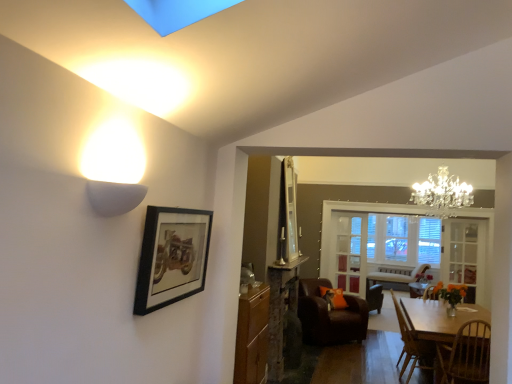
Question: Considering their positions, is clear glass door at center, the second glass door positioned from the right, located in front of or behind wooden chair at lower right, which ranks as the 2th chair in front-to-back order?

Choices:
 (A) behind
 (B) front

Answer: (A)

Question: Considering the positions of clear glass door at center, marked as the second glass door in a front-to-back arrangement, and wooden chair at lower right, the second chair in the back-to-front sequence, in the image, is clear glass door at center, marked as the second glass door in a front-to-back arrangement, wider or thinner than wooden chair at lower right, the second chair in the back-to-front sequence,?

Choices:
 (A) wide
 (B) thin

Answer: (B)

Question: Estimate the real-world distances between objects in this image. Which object is farther from the clear glass door at center, the second glass door positioned from the right?

Choices:
 (A) wooden cabinet at center
 (B) brown leather armchair at center, which is the third chair in front-to-back order
 (C) wooden dining table at lower right
 (D) wooden chair at lower right, the second chair in the back-to-front sequence
 (E) clear glass door at center, which ranks as the 2th glass door in back-to-front order

Answer: (A)

Question: Considering the real-world distances, which object is farthest from the brown leather armchair at center, which is the third chair in front-to-back order?

Choices:
 (A) clear glass door at center, which is counted as the 1th glass door, starting from the front
 (B) wooden chair at lower right, the second chair in the back-to-front sequence
 (C) brown wooden chair at lower right, the third chair in the back-to-front sequence
 (D) clear glass window at center
 (E) black matte picture frame at upper center

Answer: (E)